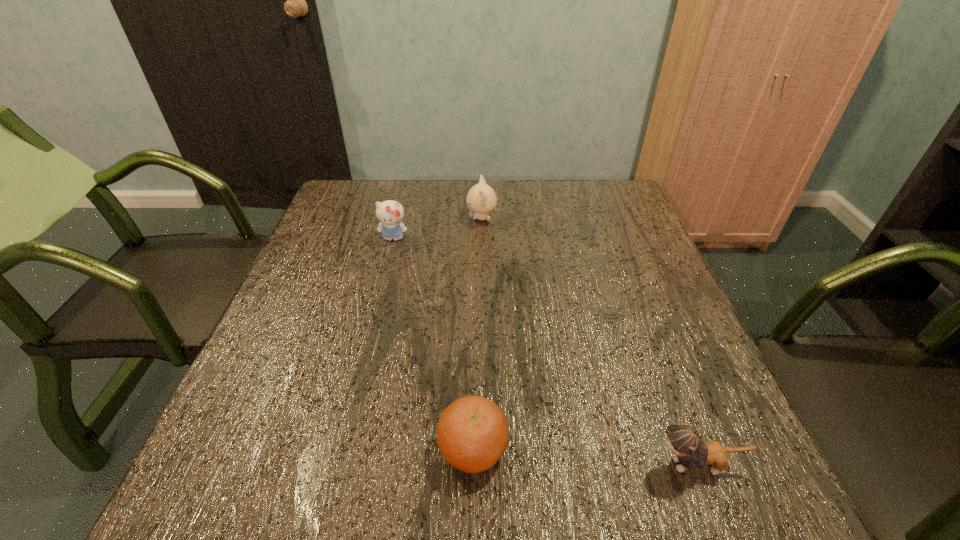
You are a GUI agent. You are given a task and a screenshot of the screen. Output one action in this format:
    pyautogui.click(x=<x>, y=<y>)
    Task: Click on the empty space that is in between the clementine and the farthest object
    
    Given the screenshot: What is the action you would take?
    pyautogui.click(x=477, y=333)

I want to click on empty location between the clementine and the leftmost object, so click(433, 343).

The width and height of the screenshot is (960, 540). I want to click on free space between the nearest kitten and the farthest object, so click(589, 341).

You are a GUI agent. You are given a task and a screenshot of the screen. Output one action in this format:
    pyautogui.click(x=<x>, y=<y>)
    Task: Click on the empty space between the farthest kitten and the second farthest object
    
    Given the screenshot: What is the action you would take?
    pyautogui.click(x=438, y=228)

Identify which object is located as the second nearest to the second kitten from left to right. Please provide its 2D coordinates. Your answer should be formatted as a tuple, i.e. [(x, y)], where the tuple contains the x and y coordinates of a point satisfying the conditions above.

[(472, 434)]

Locate an element on the screen. object identified as the closest to the rightmost object is located at coordinates (472, 434).

Choose which kitten is the third nearest neighbor to the clementine. Please provide its 2D coordinates. Your answer should be formatted as a tuple, i.e. [(x, y)], where the tuple contains the x and y coordinates of a point satisfying the conditions above.

[(481, 199)]

Identify which kitten is the second closest to the nearest kitten. Please provide its 2D coordinates. Your answer should be formatted as a tuple, i.e. [(x, y)], where the tuple contains the x and y coordinates of a point satisfying the conditions above.

[(390, 213)]

Locate an element on the screen. Image resolution: width=960 pixels, height=540 pixels. free point that satisfies the following two spatial constraints: 1. on the face of the farthest kitten; 2. on the front-facing side of the leftmost object is located at coordinates (482, 238).

Identify the location of free spot that satisfies the following two spatial constraints: 1. on the face of the farthest object; 2. on the front side of the clementine. (483, 448).